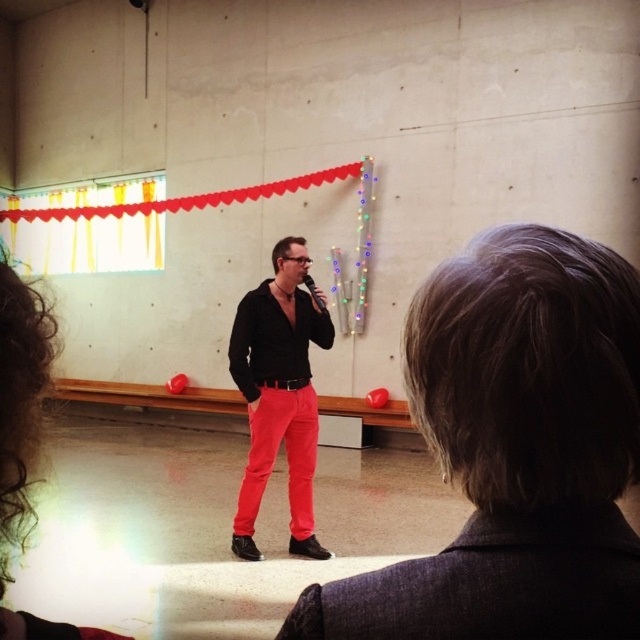
How far apart are matte black shirt at center and bright red cotton pants at center?

4.74 inches

Describe the element at coordinates (278, 394) in the screenshot. Image resolution: width=640 pixels, height=640 pixels. I see `matte black shirt at center` at that location.

Locate an element on the screen. The height and width of the screenshot is (640, 640). matte black shirt at center is located at coordinates (278, 394).

Describe the element at coordinates (278, 394) in the screenshot. This screenshot has width=640, height=640. I see `matte black shirt at center` at that location.

Is point (282, 328) farther from camera compared to point (321, 298)?

No, (282, 328) is closer to viewer.

Where is `matte black shirt at center`? matte black shirt at center is located at coordinates coord(278,394).

Who is lower down, smooth gray hair at center or black matte microphone at center?

smooth gray hair at center

Does smooth gray hair at center come in front of black matte microphone at center?

Yes.

Describe the element at coordinates (515, 451) in the screenshot. I see `smooth gray hair at center` at that location.

Locate an element on the screen. smooth gray hair at center is located at coordinates (515, 451).